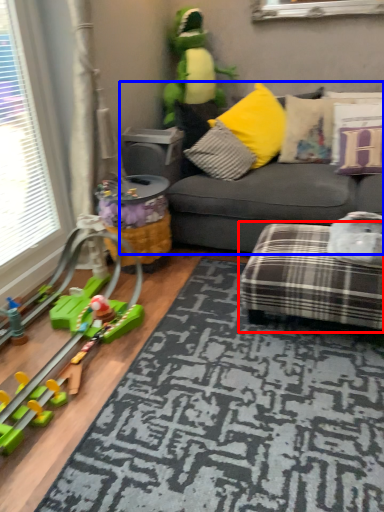
Question: Which object appears farthest to the camera in this image, studio couch (highlighted by a red box) or studio couch (highlighted by a blue box)?

Choices:
 (A) studio couch
 (B) studio couch

Answer: (B)